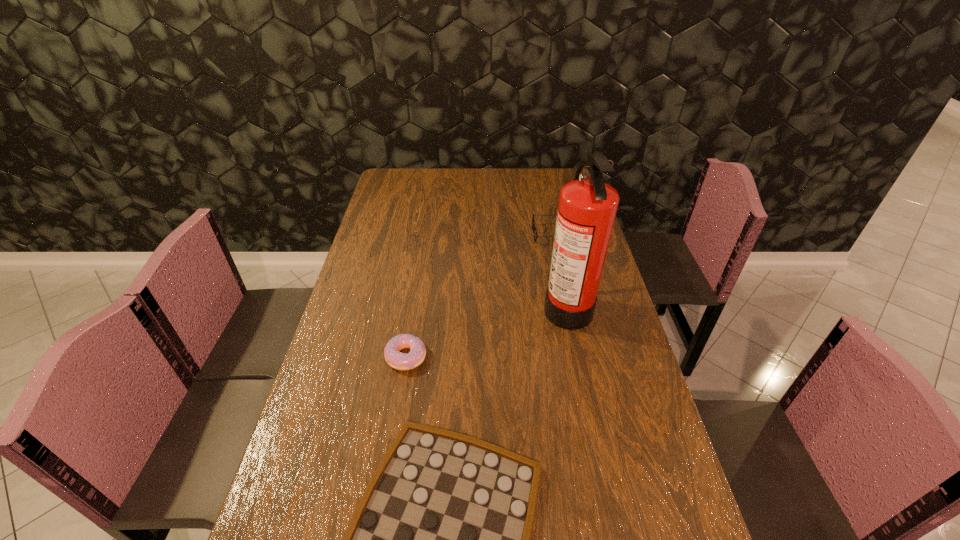
Locate an element on the screen. The width and height of the screenshot is (960, 540). vacant area that lies between the farthest object and the doughnut is located at coordinates (480, 295).

Identify which object is the nearest to the farthest object. Please provide its 2D coordinates. Your answer should be formatted as a tuple, i.e. [(x, y)], where the tuple contains the x and y coordinates of a point satisfying the conditions above.

[(587, 206)]

Image resolution: width=960 pixels, height=540 pixels. Identify the location of object that is the third closest to the checkerboard. (533, 223).